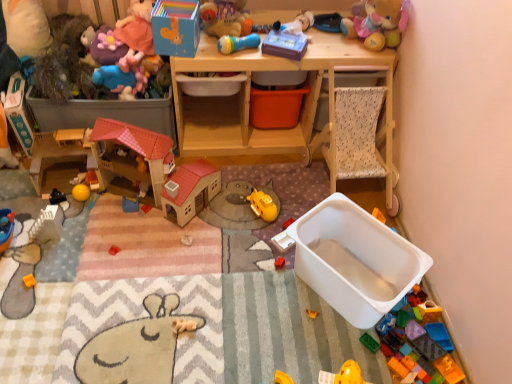
Identify the location of vacant space that is in between yellow rubber ball at center-left, which is the 11th toy from right to left, and white plastic toy at center, arranged as the tenth toy when viewed from the left. Image resolution: width=512 pixels, height=384 pixels. pyautogui.click(x=198, y=228).